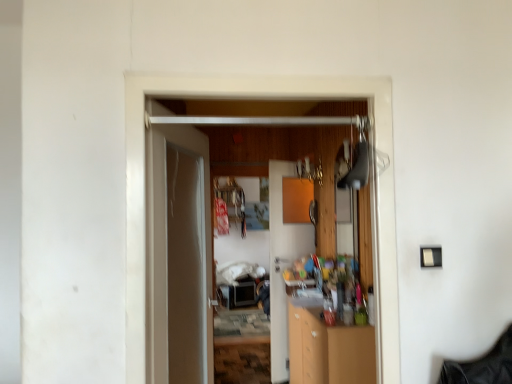
This screenshot has width=512, height=384. Identify the location of free spot above wooden door at center, marked as the 3th door in a back-to-front arrangement (from a real-world perspective). (259, 69).